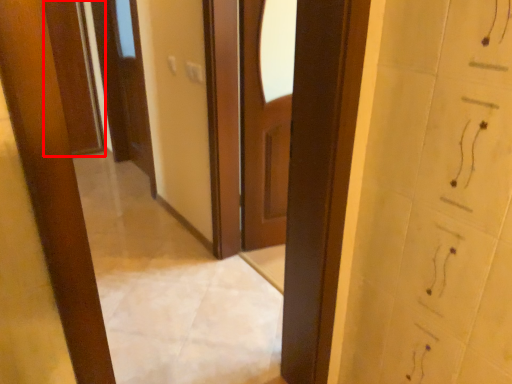
Question: From the image's perspective, considering the relative positions of door (annotated by the red box) and door in the image provided, where is door (annotated by the red box) located with respect to the staircase?

Choices:
 (A) below
 (B) above

Answer: (B)